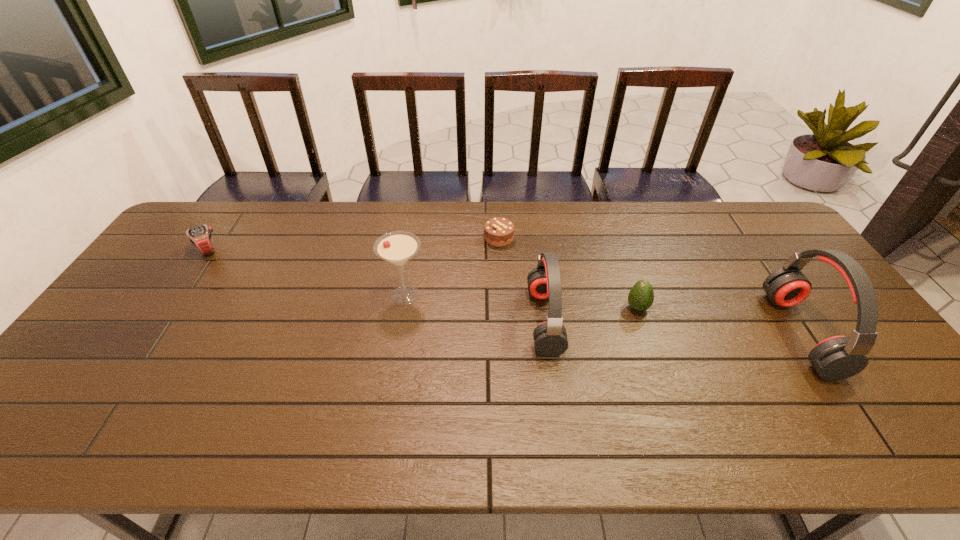
This screenshot has height=540, width=960. In order to click on object that is at the left edge in this screenshot , I will do `click(200, 236)`.

Locate an element on the screen. This screenshot has height=540, width=960. object positioned at the right edge is located at coordinates (836, 358).

Where is `object located in the far left corner section of the desktop`? Image resolution: width=960 pixels, height=540 pixels. object located in the far left corner section of the desktop is located at coordinates (200, 236).

Where is `object that is at the near right corner`? This screenshot has width=960, height=540. object that is at the near right corner is located at coordinates click(836, 358).

Where is `vacant space at the far edge of the desktop`? The width and height of the screenshot is (960, 540). vacant space at the far edge of the desktop is located at coordinates (684, 215).

The height and width of the screenshot is (540, 960). In order to click on vacant space at the near edge of the desktop in this screenshot , I will do `click(168, 410)`.

Where is `free space at the far left corner`? The image size is (960, 540). free space at the far left corner is located at coordinates (222, 239).

Find the location of a particular element. free space at the far right corner is located at coordinates (771, 231).

The width and height of the screenshot is (960, 540). In order to click on free space between the taller earphone and the avocado in this screenshot , I will do point(719,321).

Where is `empty space that is in between the rightmost object and the martini`? empty space that is in between the rightmost object and the martini is located at coordinates (603, 314).